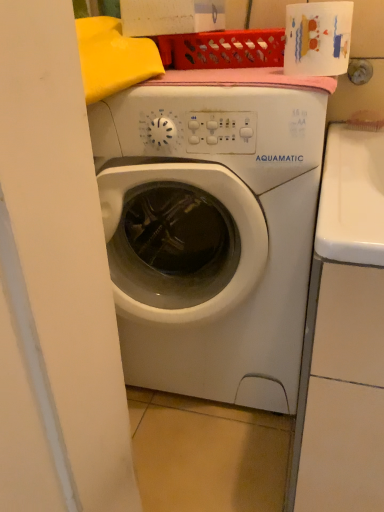
Identify the location of white matte washing machine at center. (212, 228).

Image resolution: width=384 pixels, height=512 pixels. What do you see at coordinates (212, 228) in the screenshot?
I see `white matte washing machine at center` at bounding box center [212, 228].

At what (x,y) coordinates should I click in order to perform the action: click on white glossy toilet paper at upper right. Please return your answer as a coordinate pair (x, y). This screenshot has height=512, width=384. Looking at the image, I should click on (318, 38).

Describe the element at coordinates (318, 38) in the screenshot. I see `white glossy toilet paper at upper right` at that location.

I want to click on white matte washing machine at center, so click(212, 228).

Considering the positions of objects white matte washing machine at center and white glossy toilet paper at upper right in the image provided, who is more to the right, white matte washing machine at center or white glossy toilet paper at upper right?

white glossy toilet paper at upper right.

Is white matte washing machine at center positioned in front of white glossy toilet paper at upper right?

Yes, the depth of white matte washing machine at center is less than that of white glossy toilet paper at upper right.

Is point (186, 336) less distant than point (337, 56)?

That is False.

From the image's perspective, is white matte washing machine at center positioned above or below white glossy toilet paper at upper right?

From the image's perspective, white matte washing machine at center appears below white glossy toilet paper at upper right.

From a real-world perspective, is white matte washing machine at center on white glossy toilet paper at upper right?

No, from a real-world perspective, white matte washing machine at center is not above white glossy toilet paper at upper right.

Which object is wider, white matte washing machine at center or white glossy toilet paper at upper right?

Wider between the two is white matte washing machine at center.

Is white matte washing machine at center shorter than white glossy toilet paper at upper right?

No, white matte washing machine at center is not shorter than white glossy toilet paper at upper right.

Looking at the image, does white matte washing machine at center seem bigger or smaller compared to white glossy toilet paper at upper right?

Considering their sizes, white matte washing machine at center takes up more space than white glossy toilet paper at upper right.

Choose the correct answer: Is white matte washing machine at center inside white glossy toilet paper at upper right or outside it?

white matte washing machine at center is outside white glossy toilet paper at upper right.

From the picture: Is white matte washing machine at center not near white glossy toilet paper at upper right?

No, white matte washing machine at center is in close proximity to white glossy toilet paper at upper right.

Is white matte washing machine at center aimed at white glossy toilet paper at upper right?

No, white matte washing machine at center is not turned towards white glossy toilet paper at upper right.

How many degrees apart are the facing directions of white matte washing machine at center and white glossy toilet paper at upper right?

0.00147 degrees.

Measure the distance from white matte washing machine at center to white glossy toilet paper at upper right.

The distance of white matte washing machine at center from white glossy toilet paper at upper right is 35.66 centimeters.

At what (x,y) coordinates should I click in order to perform the action: click on washing machine lying on the left of white glossy toilet paper at upper right. Please return your answer as a coordinate pair (x, y). Looking at the image, I should click on (x=212, y=228).

Is white glossy toilet paper at upper right at the right side of white matte washing machine at center?

Yes.

Which object is further away from the camera taking this photo, white glossy toilet paper at upper right or white matte washing machine at center?

white glossy toilet paper at upper right is more distant.

Does point (292, 23) appear closer or farther from the camera than point (273, 92)?

Point (292, 23).

From the image's perspective, between white glossy toilet paper at upper right and white matte washing machine at center, which one is located above?

white glossy toilet paper at upper right, from the image's perspective.

From a real-world perspective, who is located lower, white glossy toilet paper at upper right or white matte washing machine at center?

white matte washing machine at center, from a real-world perspective.

Can you confirm if white glossy toilet paper at upper right is wider than white matte washing machine at center?

In fact, white glossy toilet paper at upper right might be narrower than white matte washing machine at center.

Which of these two, white glossy toilet paper at upper right or white matte washing machine at center, stands shorter?

Standing shorter between the two is white glossy toilet paper at upper right.

Considering the relative sizes of white glossy toilet paper at upper right and white matte washing machine at center in the image provided, is white glossy toilet paper at upper right bigger than white matte washing machine at center?

Incorrect, white glossy toilet paper at upper right is not larger than white matte washing machine at center.

Is white matte washing machine at center completely or partially inside white glossy toilet paper at upper right?

Actually, white matte washing machine at center is outside white glossy toilet paper at upper right.

Can you see white glossy toilet paper at upper right touching white matte washing machine at center?

No, white glossy toilet paper at upper right is not touching white matte washing machine at center.

Is white matte washing machine at center at the back of white glossy toilet paper at upper right?

That's not correct — white glossy toilet paper at upper right is not looking away from white matte washing machine at center.

How different are the orientations of white glossy toilet paper at upper right and white matte washing machine at center in degrees?

The angle between the facing direction of white glossy toilet paper at upper right and the facing direction of white matte washing machine at center is 0.00147 degrees.

Could you measure the distance between white glossy toilet paper at upper right and white matte washing machine at center?

white glossy toilet paper at upper right and white matte washing machine at center are 14.04 inches apart from each other.

Image resolution: width=384 pixels, height=512 pixels. In order to click on washing machine that is on the left side of white glossy toilet paper at upper right in this screenshot , I will do `click(212, 228)`.

At what (x,y) coordinates should I click in order to perform the action: click on washing machine on the left of white glossy toilet paper at upper right. Please return your answer as a coordinate pair (x, y). Image resolution: width=384 pixels, height=512 pixels. Looking at the image, I should click on (212, 228).

Identify the location of toilet paper above the white matte washing machine at center (from the image's perspective). (318, 38).